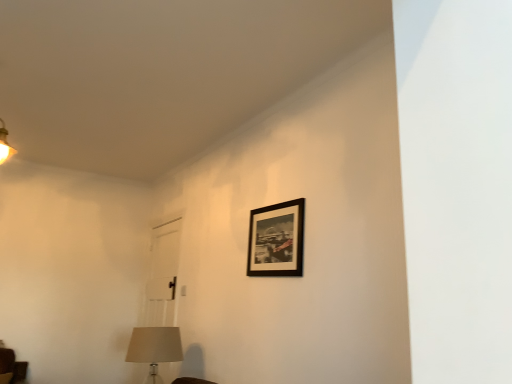
Question: From the image's perspective, is beige fabric lampshade at lower left positioned above or below black matte picture frame at upper center?

Choices:
 (A) above
 (B) below

Answer: (B)

Question: In terms of width, does beige fabric lampshade at lower left look wider or thinner when compared to black matte picture frame at upper center?

Choices:
 (A) thin
 (B) wide

Answer: (B)

Question: Is beige fabric lampshade at lower left taller or shorter than black matte picture frame at upper center?

Choices:
 (A) tall
 (B) short

Answer: (A)

Question: From the image's perspective, is black matte picture frame at upper center positioned above or below beige fabric lampshade at lower left?

Choices:
 (A) below
 (B) above

Answer: (B)

Question: Looking at the image, does black matte picture frame at upper center seem bigger or smaller compared to beige fabric lampshade at lower left?

Choices:
 (A) small
 (B) big

Answer: (A)

Question: Visually, is black matte picture frame at upper center positioned to the left or to the right of beige fabric lampshade at lower left?

Choices:
 (A) right
 (B) left

Answer: (A)

Question: In terms of width, does black matte picture frame at upper center look wider or thinner when compared to beige fabric lampshade at lower left?

Choices:
 (A) wide
 (B) thin

Answer: (B)